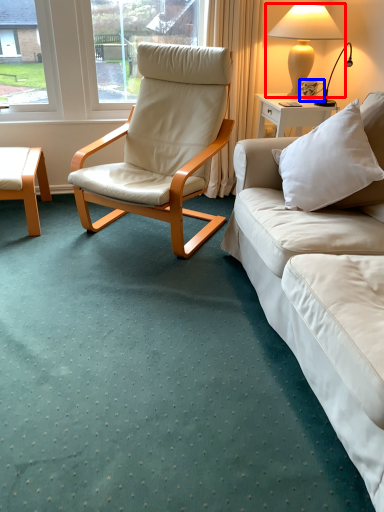
Question: Which point is closer to the camera, lamp (highlighted by a red box) or coffee cup (highlighted by a blue box)?

Choices:
 (A) lamp
 (B) coffee cup

Answer: (A)